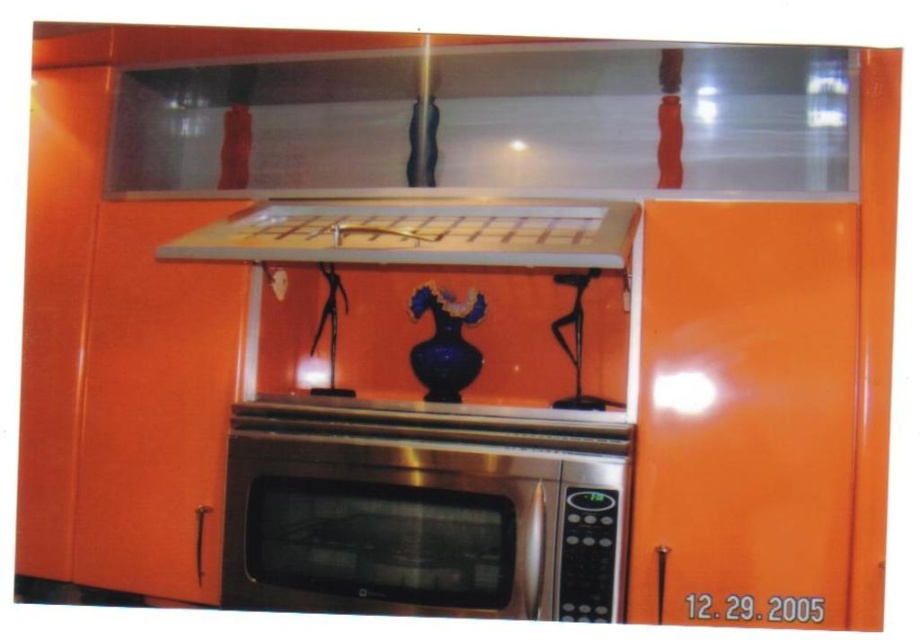
You are planning to install a new kitchen appliance in the modern kitchen shown. The appliance requires a space that is 0.5 meters wide and must be placed at coordinates between 0.6 and 0.9 on the x and y axes. Can the stainless steel microwave at center be moved to accommodate this new appliance without exceeding the required coordinates?

The stainless steel microwave at center is located at point [423,509]. Since the required y coordinate must be between 0.6 and 0.9, the current y coordinate of 0.461 is below the minimum requirement. Therefore, moving the microwave to make space for the new appliance would not satisfy the y coordinate requirement.

You are a delivery person standing in the kitchen and need to place a package that is 1.3 meters long on the matte white exhaust hood at upper center. Can the package fit on the hood?

The matte white exhaust hood at upper center is 1.32 meters from viewer. The distance from the viewer to the hood is the depth, not the length of the hood itself. Therefore, the length of the package is unrelated to the hood depth, so the package can be placed on the hood as long as its length does not exceed the hood length. However, the provided information does not specify the hood length, so we cannot determine if the package will fit based on the given data.

What are the coordinates of the stainless steel microwave at center?

The stainless steel microwave at center is located at coordinates point [423,509].